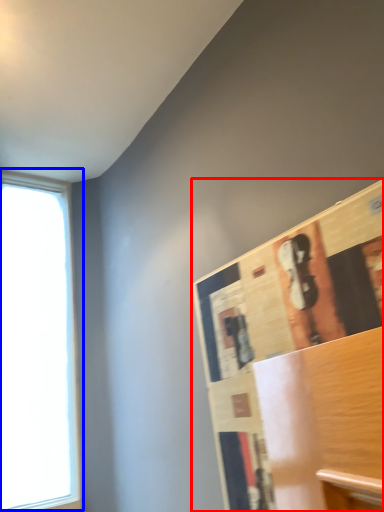
Question: Which of the following is the closest to the observer, bulletin board (highlighted by a red box) or window (highlighted by a blue box)?

Choices:
 (A) bulletin board
 (B) window

Answer: (A)